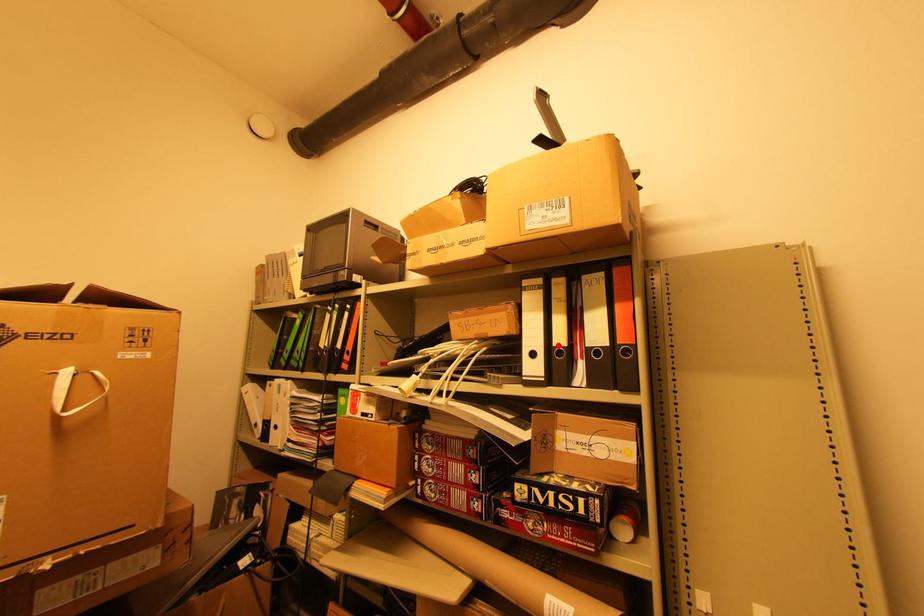
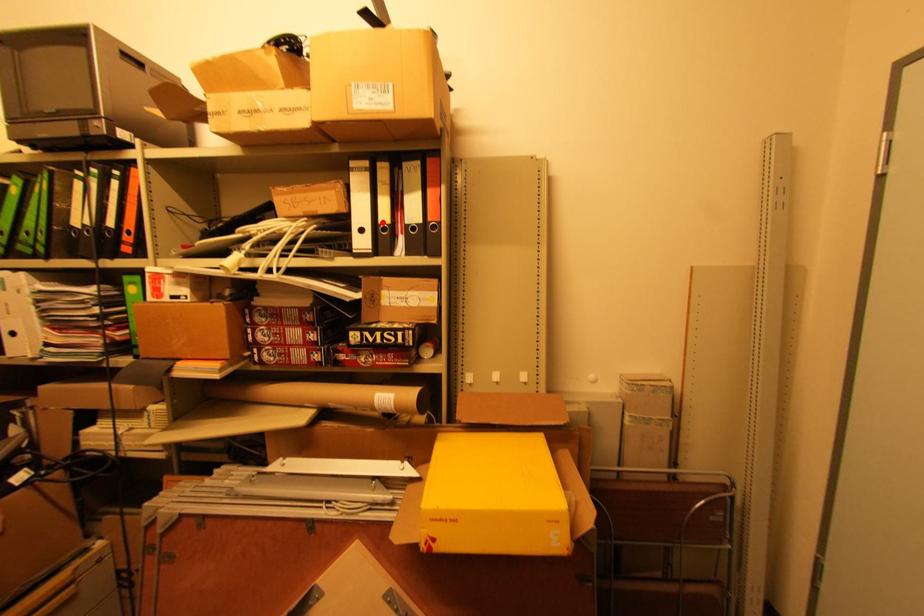
I am providing you with two images of the same scene from different viewpoints. A red point is marked on the first image and another point is marked on the second image. Does the point marked in image1 correspond to the same location as the one in image2?

Yes